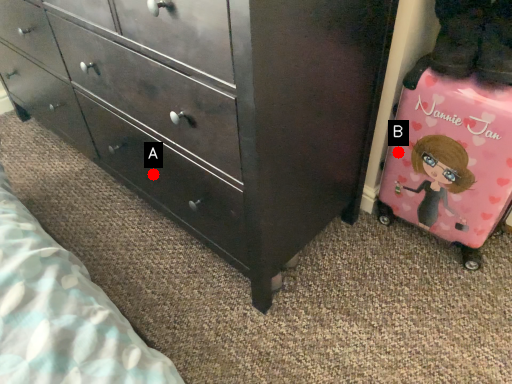
Question: Two points are circled on the image, labeled by A and B beside each circle. Among these points, which one is farthest from the camera?

Choices:
 (A) A is further
 (B) B is further

Answer: (B)